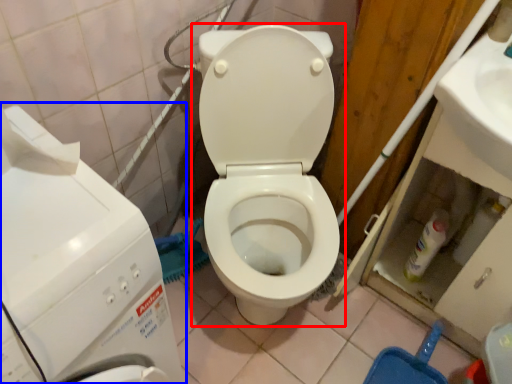
Question: Which object is further to the camera taking this photo, toilet (highlighted by a red box) or washing machine (highlighted by a blue box)?

Choices:
 (A) toilet
 (B) washing machine

Answer: (A)